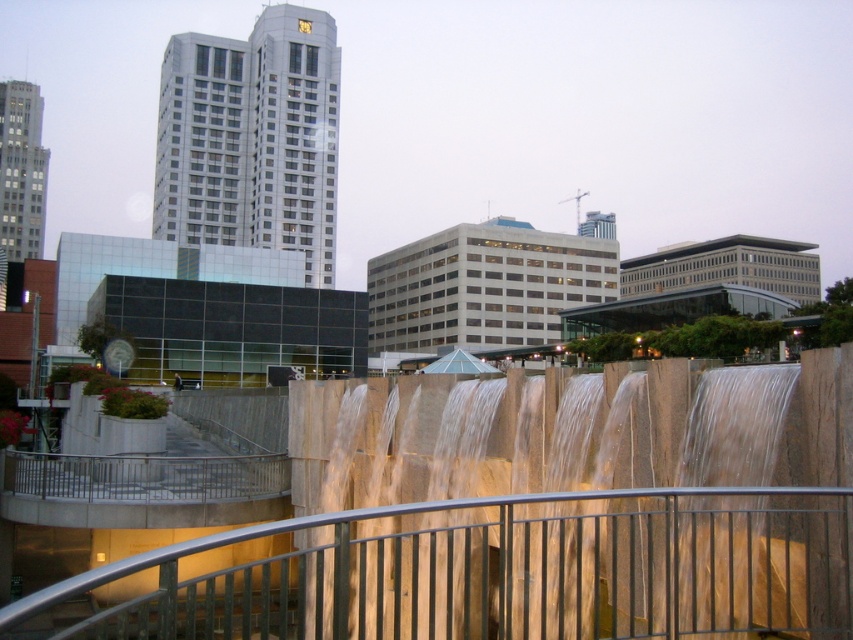
Locate an element on the screen. This screenshot has width=853, height=640. smooth stone waterfall at center is located at coordinates (561, 513).

Is point (364, 448) positioned before point (737, 586)?

No, (364, 448) is behind (737, 586).

This screenshot has height=640, width=853. I want to click on smooth stone waterfall at center, so click(561, 513).